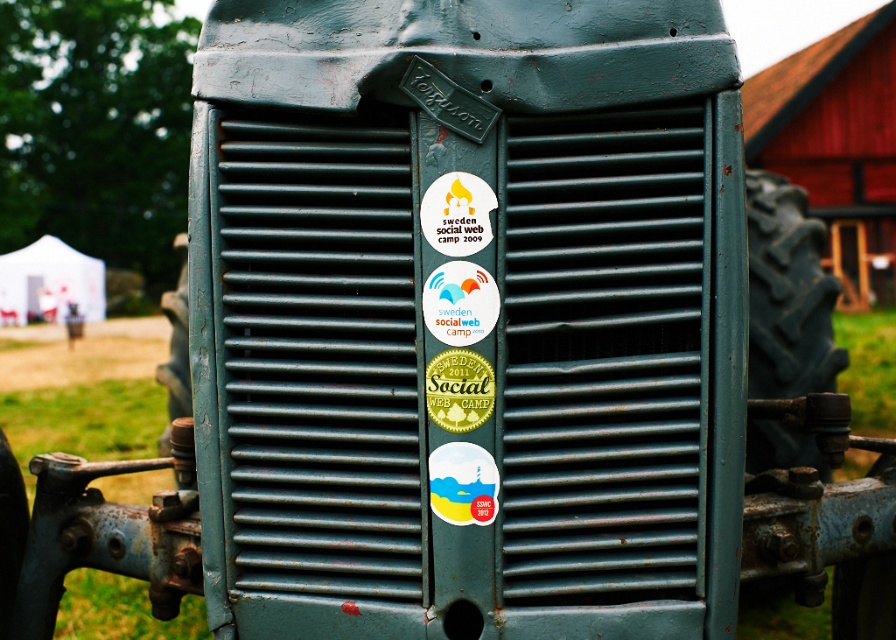
Who is positioned more to the right, matte plastic sticker at center or green matte sticker at center?

matte plastic sticker at center is more to the right.

Locate an element on the screen. matte plastic sticker at center is located at coordinates (463, 483).

You are a GUI agent. You are given a task and a screenshot of the screen. Output one action in this format:
    pyautogui.click(x=<x>, y=<y>)
    Task: Click on the matte plastic sticker at center
    
    Given the screenshot: What is the action you would take?
    pyautogui.click(x=463, y=483)

Does white glossy sticker at center appear under white paper sticker at center?

Yes, white glossy sticker at center is below white paper sticker at center.

What do you see at coordinates (459, 301) in the screenshot? The height and width of the screenshot is (640, 896). I see `white glossy sticker at center` at bounding box center [459, 301].

At what (x,y) coordinates should I click in order to perform the action: click on white glossy sticker at center. Please return your answer as a coordinate pair (x, y). Image resolution: width=896 pixels, height=640 pixels. Looking at the image, I should click on (459, 301).

Does white glossy sticker at center appear on the left side of matte plastic sticker at center?

Indeed, white glossy sticker at center is positioned on the left side of matte plastic sticker at center.

Which is in front, point (429, 292) or point (478, 460)?

Point (478, 460) is in front.

Does point (434, 310) lie behind point (435, 454)?

No.

Find the location of `white glossy sticker at center`. white glossy sticker at center is located at coordinates (459, 301).